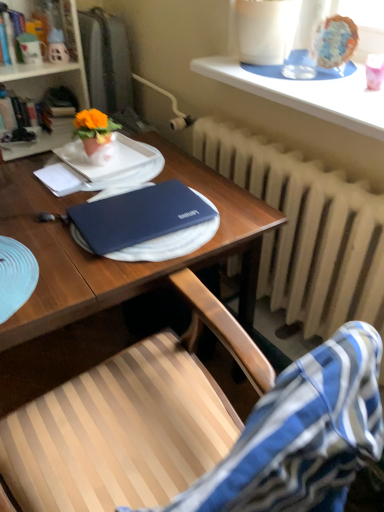
Locate an element on the screen. The image size is (384, 512). free space to the left of white paper at left is located at coordinates (19, 181).